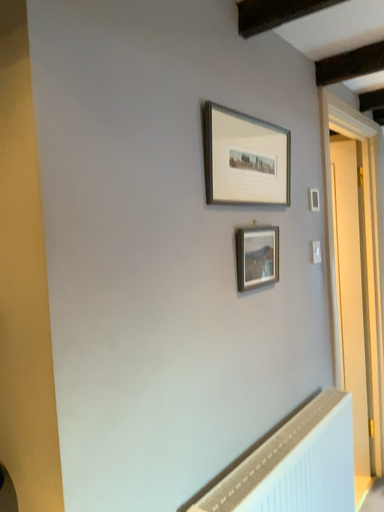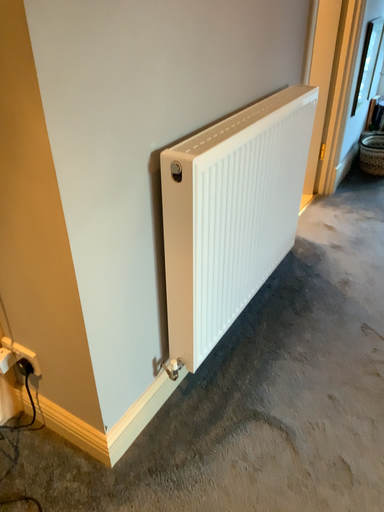
Question: How did the camera likely rotate when shooting the video?

Choices:
 (A) rotated upward
 (B) rotated downward

Answer: (B)